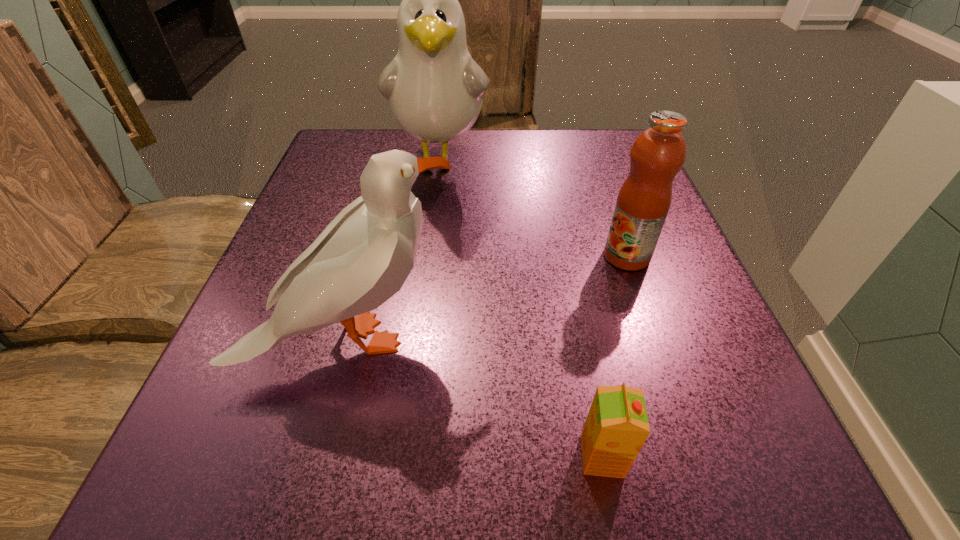
Locate an element on the screen. vacant space located on the front label of the third nearest object is located at coordinates (387, 256).

Locate an element on the screen. vacant space located 0.130m on the front label of the third nearest object is located at coordinates (528, 256).

Where is `vacant area located 0.240m on the front label of the third nearest object`? This screenshot has height=540, width=960. vacant area located 0.240m on the front label of the third nearest object is located at coordinates (464, 256).

Find the location of a particular element. free space located 0.180m on the back of the third object from left to right is located at coordinates (575, 319).

Find the location of `object at the far edge`. object at the far edge is located at coordinates (435, 89).

Image resolution: width=960 pixels, height=540 pixels. In order to click on object that is at the near edge in this screenshot , I will do `click(616, 428)`.

I want to click on object at the right edge, so click(x=658, y=153).

Identify the location of object that is at the far left corner. This screenshot has height=540, width=960. (435, 89).

Image resolution: width=960 pixels, height=540 pixels. In the image, there is a desktop. Find the location of `vacant space at the far edge`. vacant space at the far edge is located at coordinates (514, 142).

At what (x,y) coordinates should I click in order to perform the action: click on vacant point at the near edge. Please return your answer as a coordinate pair (x, y). The image size is (960, 540). Looking at the image, I should click on (612, 492).